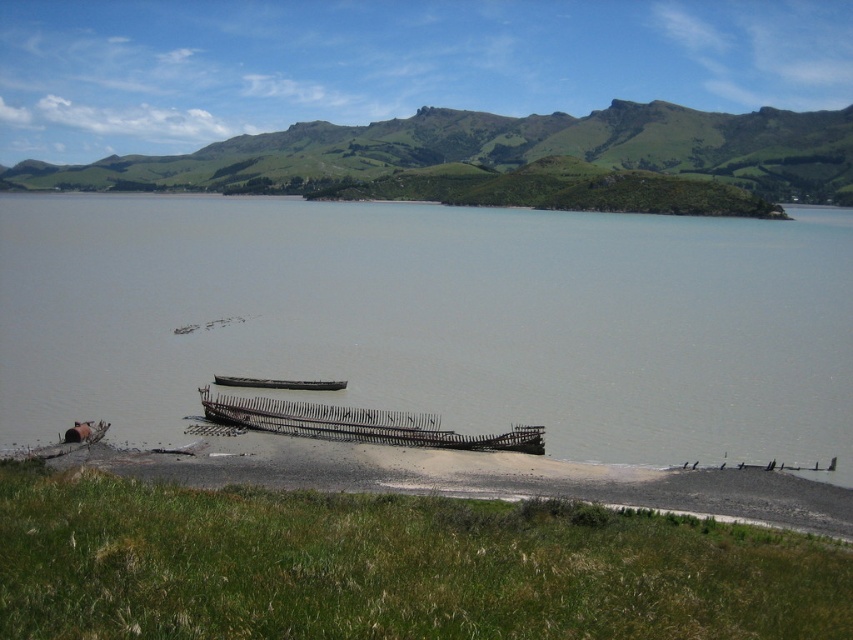
You are standing on the grassy shore of the lake and see the rusty metal shipwreck at lower left and the wooden boat at center. Which object is closer to the water?

The rusty metal shipwreck at lower left is closer to the water because it is positioned below the wooden boat at center, which places it nearer to the shoreline and the water body.

You are an environmental inspector assessing the scene. You need to determine which object is higher in elevation between the rusty metal shipwreck at lower left and the wooden boat at center. Based on the description, which one is taller?

The rusty metal shipwreck at lower left is much taller than the wooden boat at center.

You are standing at the center of the grassy area in the foreground of the image. Which direction should you walk to reach the rusty metal shipwreck at lower left?

You should walk towards the lower left direction to reach the rusty metal shipwreck at lower left since it is located at point coordinates lower left.